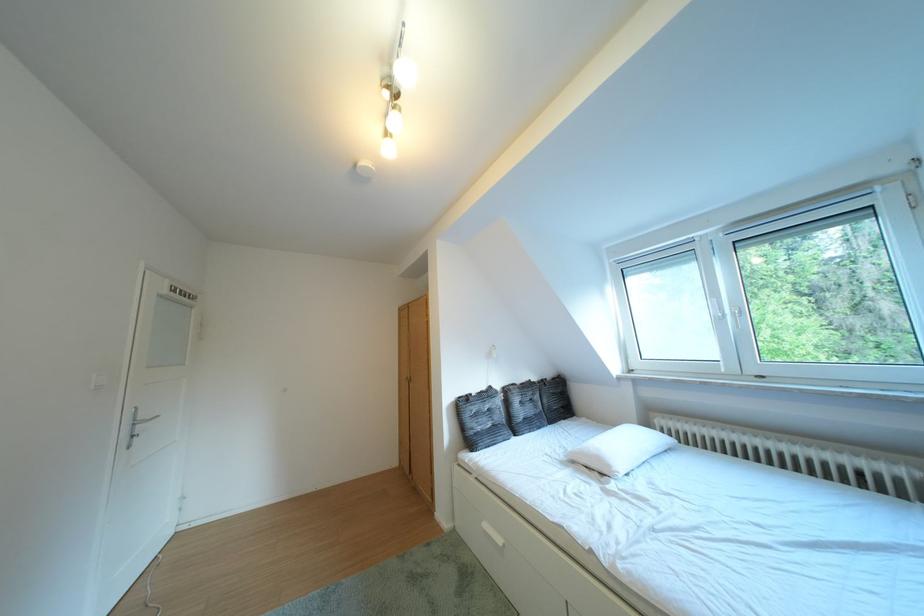
At what (x,y) coordinates should I click in order to perform the action: click on white drawer handle. Please return your answer as a coordinate pair (x, y). The width and height of the screenshot is (924, 616). Looking at the image, I should click on (492, 533).